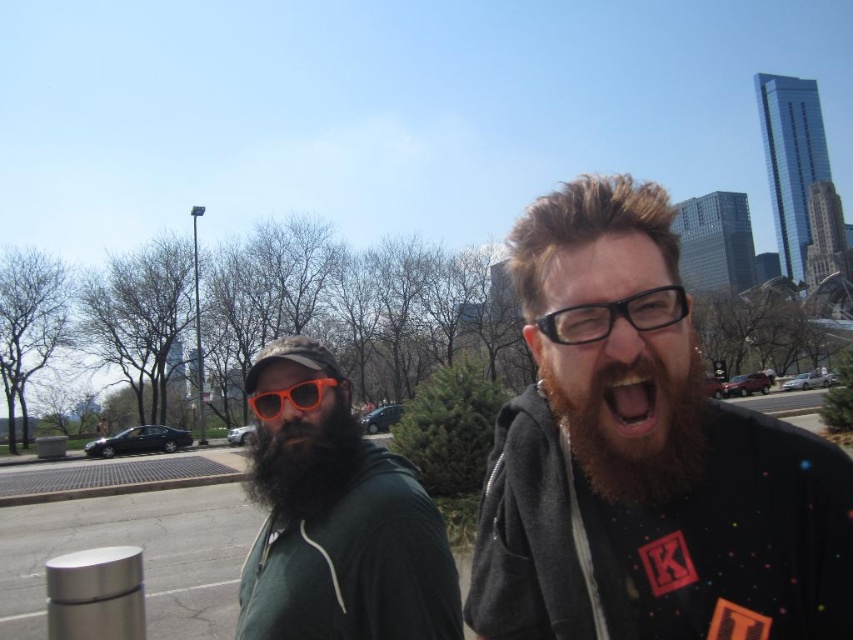
You are a photographer trying to capture a group photo of the dark gray hoodie at center and the brownwoollybeard at right. Since you want both subjects to be centered in the frame, which direction should you move the camera to align them properly?

The dark gray hoodie at center is to the left of brownwoollybeard at right. To center both subjects in the frame, move the camera slightly to the right so that the dark gray hoodie at center shifts towards the center and the brownwoollybeard at right moves leftward into alignment.

Looking at this image, you are a photographer trying to capture a clear photo of both the green matte hoodie at center and the black plastic glasses at center. Since you want both objects to be in focus, you need to adjust your camera settings. Considering their sizes, which object should you focus on to ensure both are sharp?

The green matte hoodie at center is taller than black plastic glasses at center. To ensure both are sharp, focus on the green matte hoodie at center because it is larger and will require more precise focus.

You are designing a poster for a community event and need to ensure that the dark gray hoodie at center and the brownwoollybeard at right are clearly visible. Given their sizes, which object should be placed closer to the front of the poster to maintain visual balance?

The dark gray hoodie at center should be placed closer to the front of the poster because it has a larger size compared to the brownwoollybeard at right, ensuring visual balance by compensating for its bigger size.